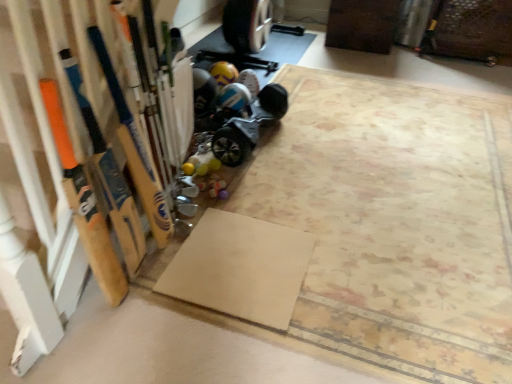
Identify the location of free space in front of wooden baseball bat at left, which ranks as the 2th baseball bat in right-to-left order. This screenshot has height=384, width=512. 94,340.